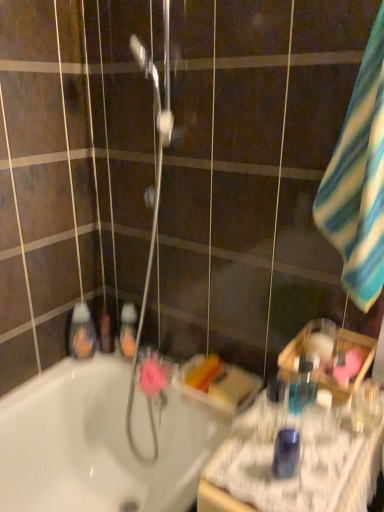
Where is `empty space that is to the right of blue plastic mouthwash at right, positioned as the fourth mouthwash in left-to-right order`? empty space that is to the right of blue plastic mouthwash at right, positioned as the fourth mouthwash in left-to-right order is located at coordinates (332, 443).